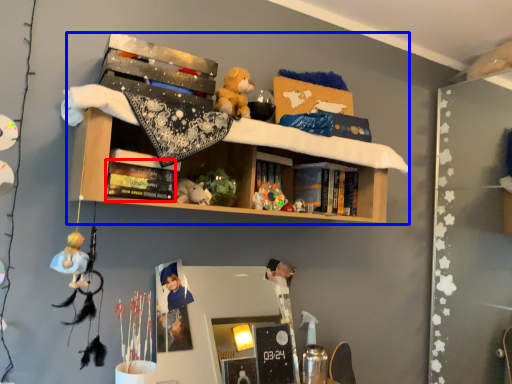
Question: Which of the following is the closest to the observer, book (highlighted by a red box) or shelf (highlighted by a blue box)?

Choices:
 (A) book
 (B) shelf

Answer: (B)